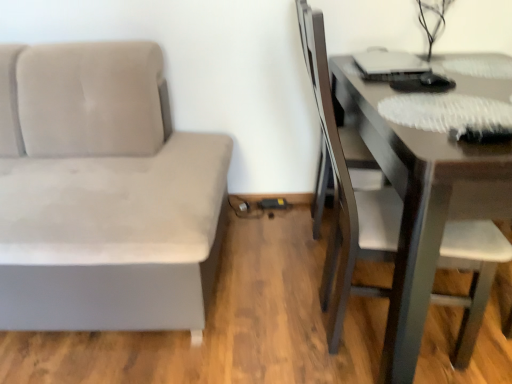
Question: Can you confirm if matte black swivel chair at right is positioned to the left of dark brown wooden table at right?

Choices:
 (A) no
 (B) yes

Answer: (B)

Question: Is dark brown wooden table at right inside matte black swivel chair at right?

Choices:
 (A) yes
 (B) no

Answer: (B)

Question: Can you confirm if matte black swivel chair at right is shorter than dark brown wooden table at right?

Choices:
 (A) no
 (B) yes

Answer: (A)

Question: Is dark brown wooden table at right at the back of matte black swivel chair at right?

Choices:
 (A) yes
 (B) no

Answer: (A)

Question: Considering the relative positions of matte black swivel chair at right and dark brown wooden table at right in the image provided, is matte black swivel chair at right in front of dark brown wooden table at right?

Choices:
 (A) yes
 (B) no

Answer: (B)

Question: From the image's perspective, is matte black swivel chair at right over dark brown wooden table at right?

Choices:
 (A) yes
 (B) no

Answer: (A)

Question: Does matte black swivel chair at right appear on the left side of suede gray couch at left?

Choices:
 (A) no
 (B) yes

Answer: (A)

Question: Considering the relative positions of matte black swivel chair at right and suede gray couch at left in the image provided, is matte black swivel chair at right to the right of suede gray couch at left from the viewer's perspective?

Choices:
 (A) yes
 (B) no

Answer: (A)

Question: Can you confirm if matte black swivel chair at right is smaller than suede gray couch at left?

Choices:
 (A) yes
 (B) no

Answer: (A)

Question: Is matte black swivel chair at right wider than suede gray couch at left?

Choices:
 (A) no
 (B) yes

Answer: (A)

Question: Is matte black swivel chair at right not within suede gray couch at left?

Choices:
 (A) no
 (B) yes

Answer: (B)

Question: From the image's perspective, is matte black swivel chair at right located above suede gray couch at left?

Choices:
 (A) no
 (B) yes

Answer: (B)

Question: Is suede gray couch at left behind matte black swivel chair at right?

Choices:
 (A) no
 (B) yes

Answer: (A)